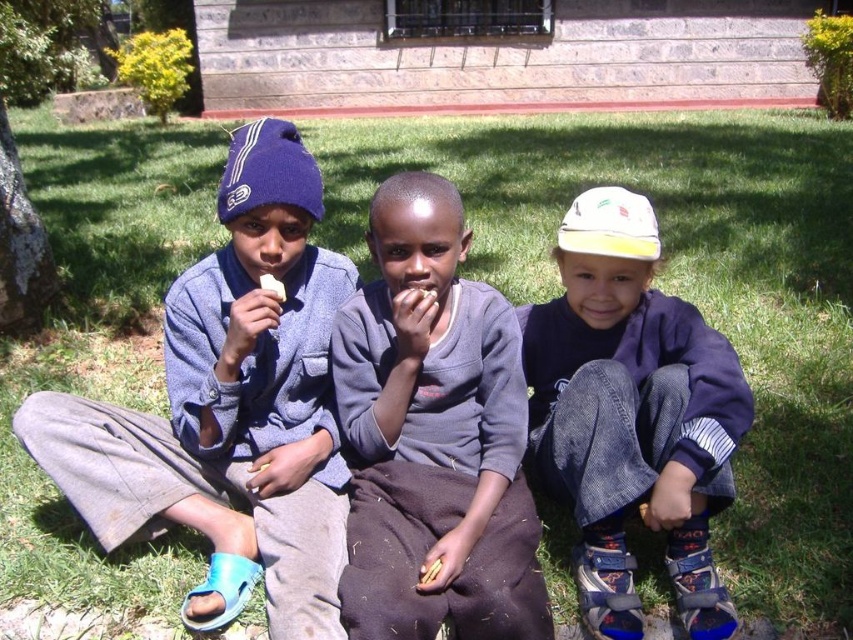
Can you confirm if white cotton cap at center is smaller than white cotton baseball cap at center?

Actually, white cotton cap at center might be larger than white cotton baseball cap at center.

At what (x,y) coordinates should I click in order to perform the action: click on white cotton cap at center. Please return your answer as a coordinate pair (x, y). The height and width of the screenshot is (640, 853). Looking at the image, I should click on (631, 413).

Is point (630, 305) closer to camera compared to point (646, 212)?

No, it is not.

Locate an element on the screen. white cotton cap at center is located at coordinates (631, 413).

Between blue knit beanie at left and white creamy bread at center, which one has less height?

white creamy bread at center is shorter.

Can you confirm if blue knit beanie at left is smaller than white creamy bread at center?

Incorrect, blue knit beanie at left is not smaller in size than white creamy bread at center.

Which is in front, point (323, 564) or point (283, 292)?

Point (323, 564) is more forward.

Image resolution: width=853 pixels, height=640 pixels. Identify the location of blue knit beanie at left. (230, 408).

Between point (618, 250) and point (434, 563), which one is positioned behind?

Point (618, 250)

Find the location of a particular element. The height and width of the screenshot is (640, 853). white cotton baseball cap at center is located at coordinates (610, 225).